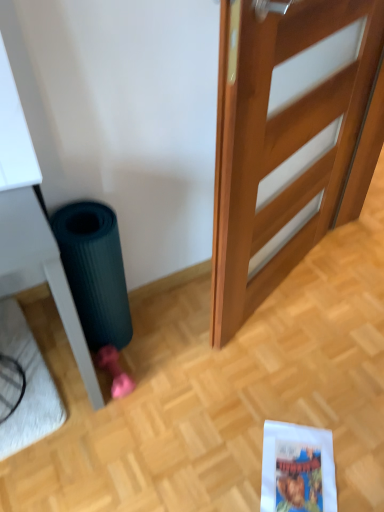
Image resolution: width=384 pixels, height=512 pixels. In order to click on vacant space to the right of blue glossy comic book at lower right in this screenshot , I will do `click(358, 456)`.